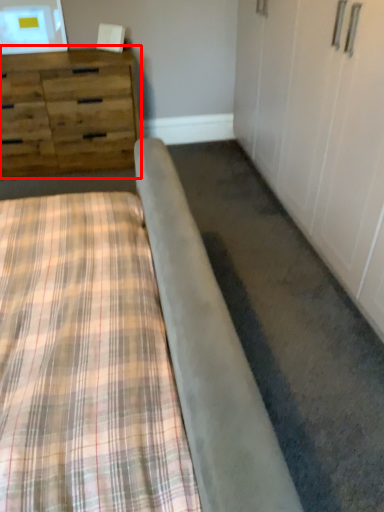
Question: From the image's perspective, considering the relative positions of chest of drawers (annotated by the red box) and bed in the image provided, where is chest of drawers (annotated by the red box) located with respect to the staircase?

Choices:
 (A) below
 (B) above

Answer: (B)